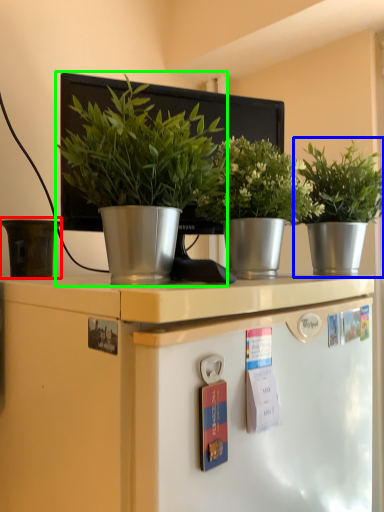
Question: Estimate the real-world distances between objects in this image. Which object is farther from flowerpot (highlighted by a red box), houseplant (highlighted by a blue box) or houseplant (highlighted by a green box)?

Choices:
 (A) houseplant
 (B) houseplant

Answer: (A)